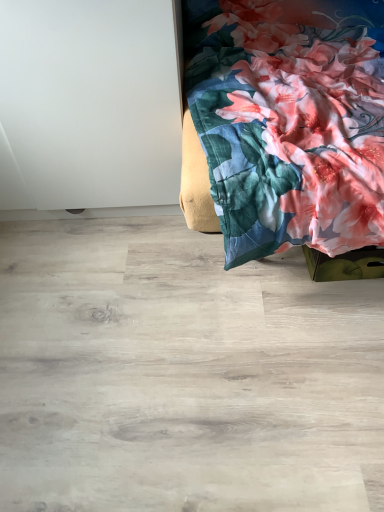
This screenshot has height=512, width=384. Identify the location of empty space that is ontop of natural wood floor at lower center (from a real-world perspective). (178, 325).